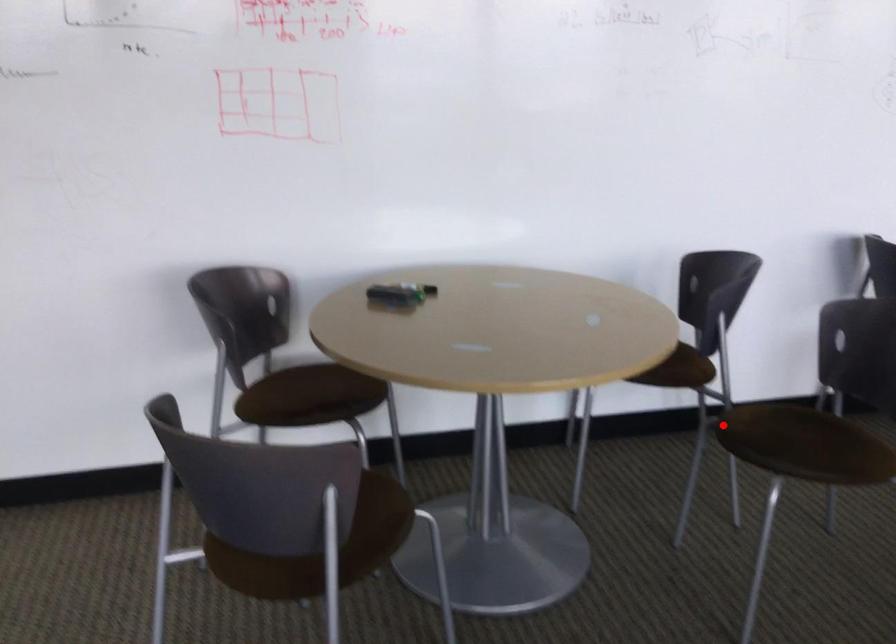
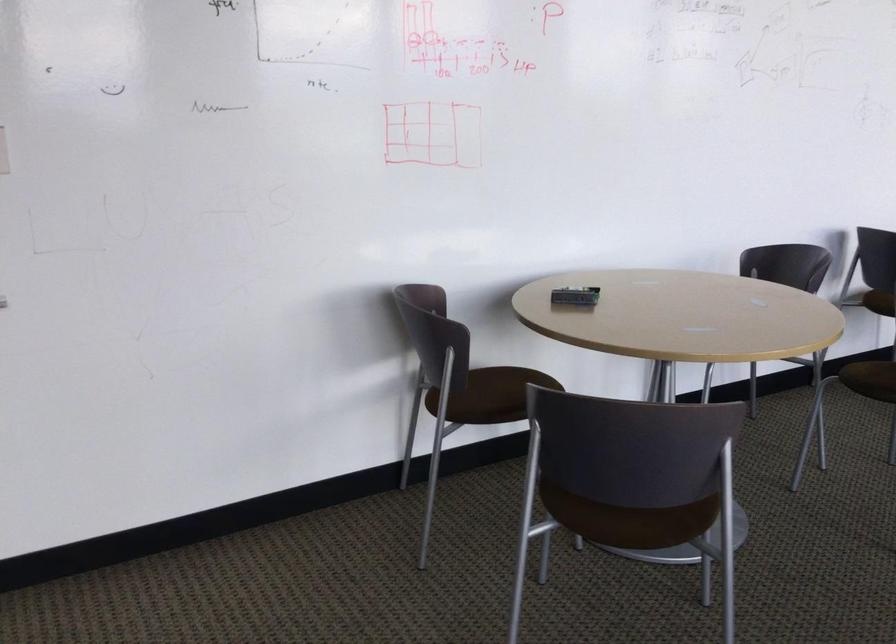
Question: I am providing you with two images of the same scene from different viewpoints. In image1, a red point is highlighted. Considering the same 3D point in image2, which of the following is correct?

Choices:
 (A) It is closer
 (B) It is farther

Answer: (B)